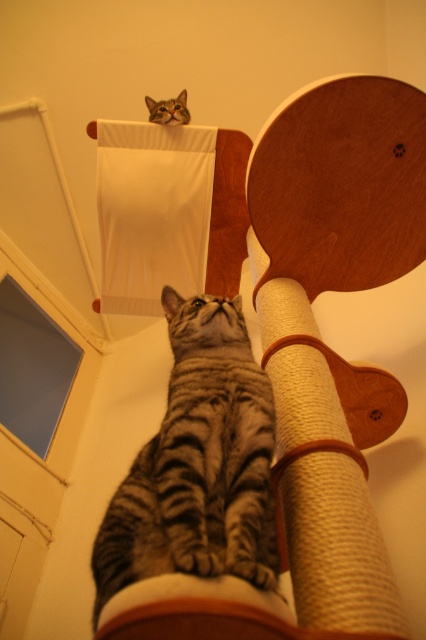
You are a cat owner who wants to ensure your tabby fur cat at upper center has enough space to stretch out on the sanded wood scratching post at center. Based on the scene, can you determine if the scratching post is wide enough for the cat?

The sanded wood scratching post at center is wider than the tabby fur cat at upper center, so it should provide sufficient space for the cat to stretch out comfortably.

You are a cat owner trying to place a new toy on the cat tree. The toy needs to be placed between the sanded wood scratching post at center and the tabby fur cat at upper center. Based on their positions, where should you place the toy?

The sanded wood scratching post at center is to the right of the tabby fur cat at upper center, so the toy should be placed between them by positioning it to the left of the sanded wood scratching post at center and to the right of the tabby fur cat at upper center.

You are a cat owner who wants to place a new toy on the cat tree. The toy needs to be placed on the sanded wood scratching post at center so that the gray tabby cat at center can easily reach it. Where should you place the toy relative to the cat?

The sanded wood scratching post at center is positioned on the right side of the gray tabby cat at center, so you should place the toy on the right side of the cat to ensure it can easily reach it.